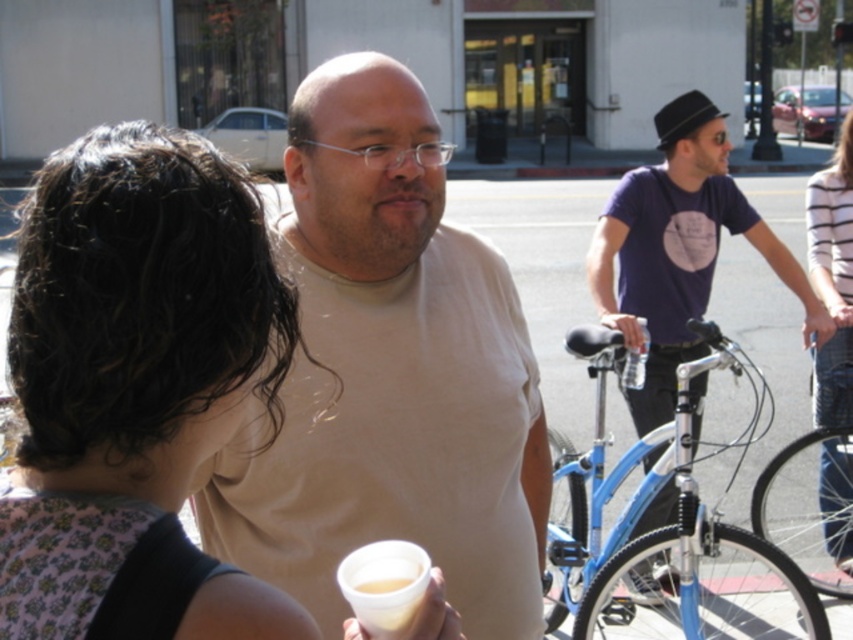
Question: Which object is positioned farthest from the striped cotton shirt at right?

Choices:
 (A) beige t-shirt at center
 (B) matte purple t-shirt at center

Answer: (A)

Question: Does blue metallic bicycle at center-right have a larger size compared to striped cotton shirt at right?

Choices:
 (A) yes
 (B) no

Answer: (A)

Question: Which point is closer to the camera?

Choices:
 (A) blue metallic bicycle at center-right
 (B) striped cotton shirt at right
 (C) matte purple t-shirt at center

Answer: (A)

Question: Which of the following is the closest to the observer?

Choices:
 (A) matte purple t-shirt at center
 (B) blue metallic bicycle at center-right
 (C) striped cotton shirt at right
 (D) beige t-shirt at center

Answer: (D)

Question: Does floral fabric dress at center have a lesser width compared to translucent plastic cup at lower center?

Choices:
 (A) yes
 (B) no

Answer: (B)

Question: Is beige t-shirt at center smaller than matte purple t-shirt at center?

Choices:
 (A) no
 (B) yes

Answer: (B)